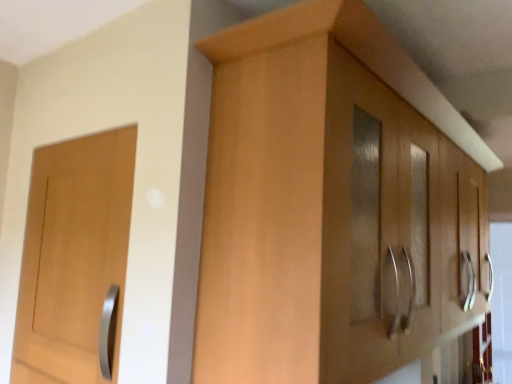
Question: From the image's perspective, is light wood cabinet at center located above or below matte wood door at left?

Choices:
 (A) above
 (B) below

Answer: (A)

Question: Considering the positions of light wood cabinet at center and matte wood door at left in the image, is light wood cabinet at center bigger or smaller than matte wood door at left?

Choices:
 (A) big
 (B) small

Answer: (A)

Question: Relative to matte wood door at left, is light wood cabinet at center in front or behind?

Choices:
 (A) behind
 (B) front

Answer: (B)

Question: Considering the positions of point click(x=29, y=220) and point click(x=373, y=86), is point click(x=29, y=220) closer or farther from the camera than point click(x=373, y=86)?

Choices:
 (A) closer
 (B) farther

Answer: (B)

Question: Considering the relative positions of matte wood door at left and light wood cabinet at center in the image provided, is matte wood door at left to the left or to the right of light wood cabinet at center?

Choices:
 (A) right
 (B) left

Answer: (B)

Question: Considering their positions, is matte wood door at left located in front of or behind light wood cabinet at center?

Choices:
 (A) behind
 (B) front

Answer: (A)

Question: From the image's perspective, is matte wood door at left above or below light wood cabinet at center?

Choices:
 (A) below
 (B) above

Answer: (A)